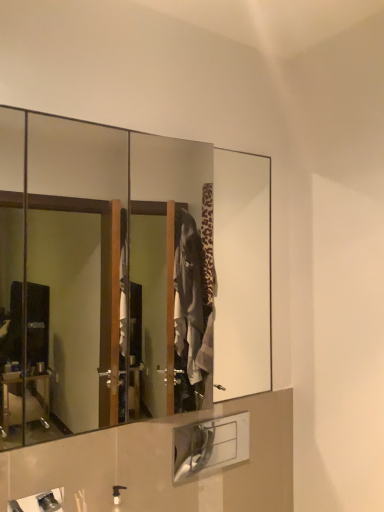
The height and width of the screenshot is (512, 384). What do you see at coordinates (126, 276) in the screenshot? I see `matte glass dresser at upper center` at bounding box center [126, 276].

In order to face matte glass dresser at upper center, should I rotate leftwards or rightwards?

You should look left and rotate roughly 3.928 degrees.

Image resolution: width=384 pixels, height=512 pixels. Find the location of `matte glass dresser at upper center`. matte glass dresser at upper center is located at coordinates (126, 276).

You are a GUI agent. You are given a task and a screenshot of the screen. Output one action in this format:
    pyautogui.click(x=<x>, y=<y>)
    Task: Click on the matte glass dresser at upper center
    The width and height of the screenshot is (384, 512).
    Given the screenshot: What is the action you would take?
    pyautogui.click(x=126, y=276)